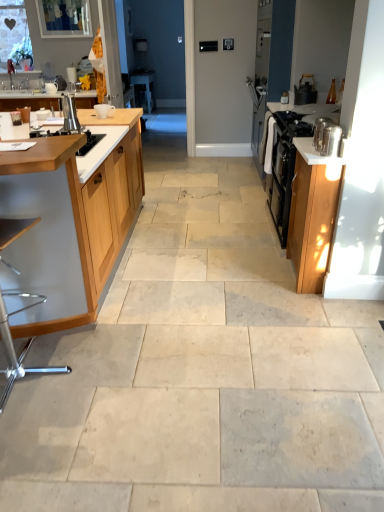
Question: Considering the positions of point (92, 287) and point (253, 435), is point (92, 287) closer or farther from the camera than point (253, 435)?

Choices:
 (A) closer
 (B) farther

Answer: (B)

Question: From a real-world perspective, relative to beige stone floor at center, is wooden cabinet at left, the second cabinetry viewed from the right, vertically above or below?

Choices:
 (A) above
 (B) below

Answer: (A)

Question: Estimate the real-world distances between objects in this image. Which object is closer to the clear glass window at upper left?

Choices:
 (A) matte silver sink at left
 (B) matte black kettle at upper right
 (C) white glossy table at center
 (D) metallic silver canister at right, which is counted as the first appliance, starting from the right
 (E) transparent glass screen door at center

Answer: (E)

Question: Which is farther from the transparent glass screen door at center?

Choices:
 (A) metallic silver containers at right
 (B) satin silver kettle at left, which appears as the second appliance when viewed from the front
 (C) matte black kettle at upper right
 (D) matte silver sink at left
 (E) clear glass window at upper left

Answer: (A)